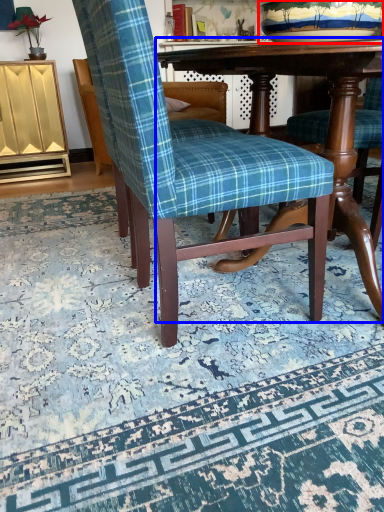
Question: Which object appears closest to the camera in this image, bowl (highlighted by a red box) or table (highlighted by a blue box)?

Choices:
 (A) bowl
 (B) table

Answer: (B)